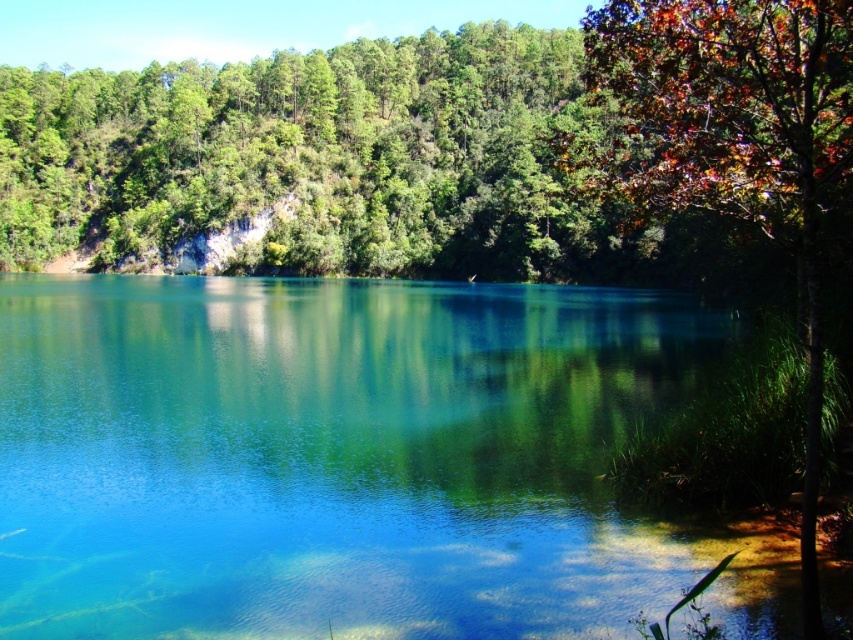
Can you confirm if transparent water at center is wider than autumn leaves at right?

Correct, the width of transparent water at center exceeds that of autumn leaves at right.

Does transparent water at center lie behind autumn leaves at right?

That is True.

Does point (13, 355) come farther from viewer compared to point (805, 10)?

That is True.

The height and width of the screenshot is (640, 853). In order to click on transparent water at center in this screenshot , I will do `click(329, 456)`.